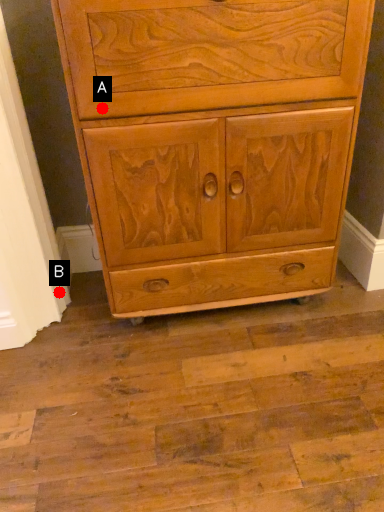
Question: Two points are circled on the image, labeled by A and B beside each circle. Among these points, which one is nearest to the camera?

Choices:
 (A) A is closer
 (B) B is closer

Answer: (A)